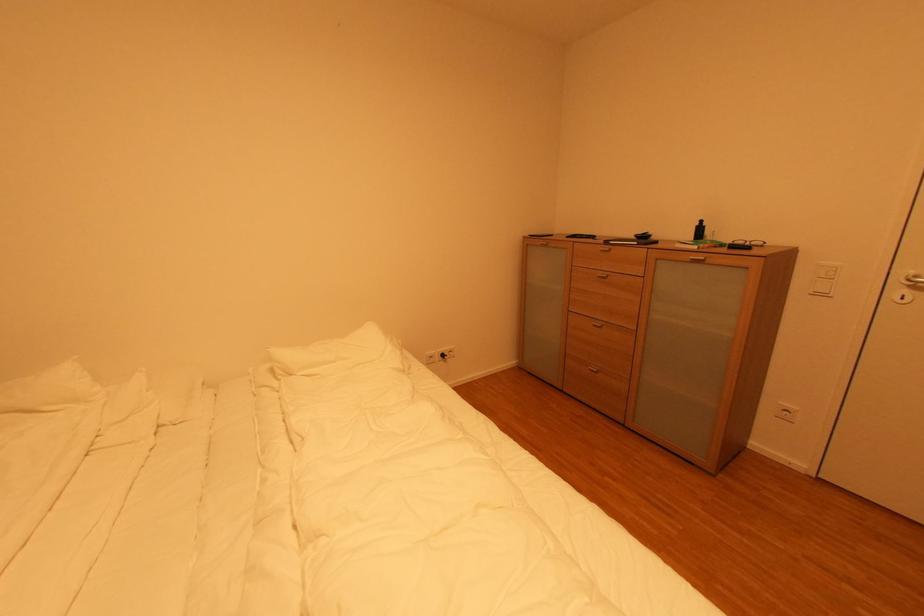
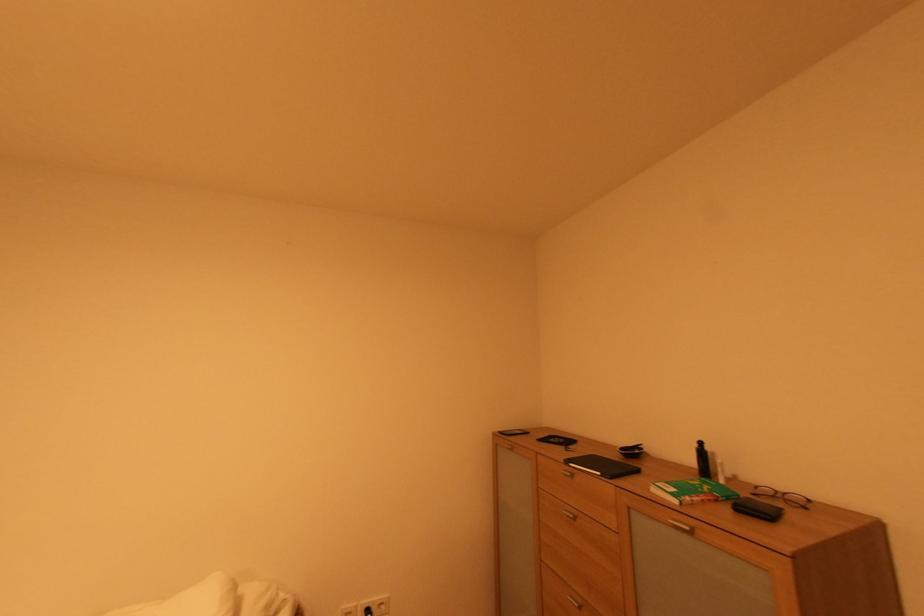
Where in the second image is the point corresponding to pixel 748 243 from the first image?

(777, 493)